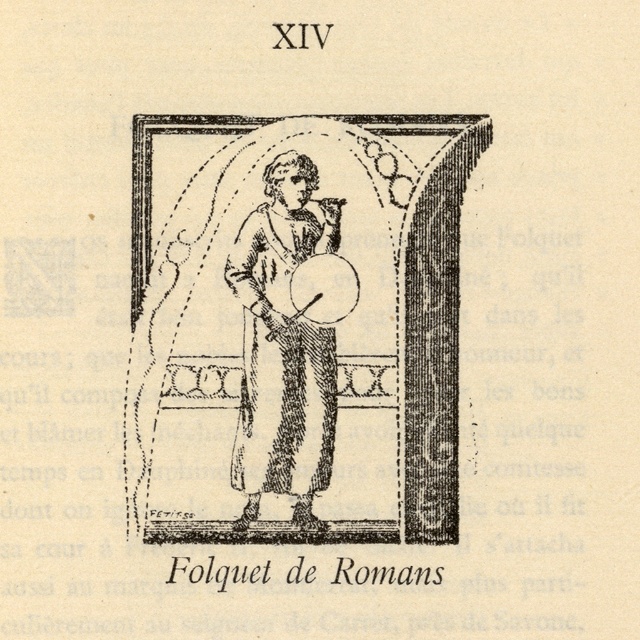
Can you confirm if black ink drawing of man at center is positioned above black ink drawing of person at center?

Indeed, black ink drawing of man at center is positioned over black ink drawing of person at center.

Can you confirm if black ink drawing of man at center is positioned below black ink drawing of person at center?

No.

The height and width of the screenshot is (640, 640). Find the location of `black ink drawing of man at center`. black ink drawing of man at center is located at coordinates (298, 330).

Locate an element on the screen. The height and width of the screenshot is (640, 640). black ink drawing of man at center is located at coordinates (298, 330).